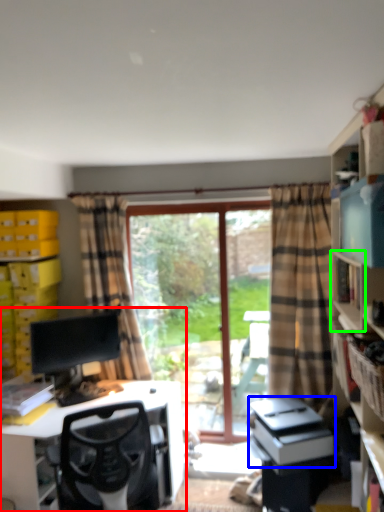
Question: Which object is positioned closest to entertainment center (highlighted by a red box)? Select from printer (highlighted by a blue box) and shelf (highlighted by a green box).

Choices:
 (A) printer
 (B) shelf

Answer: (A)